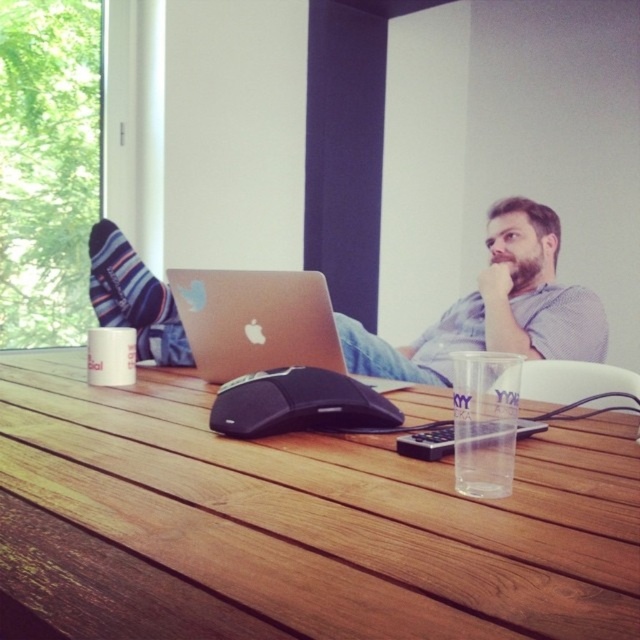
Which is behind, point (225, 381) or point (250, 412)?

The point (225, 381) is behind.

Can you confirm if silver metallic laptop at center is shorter than black matte mouse at center?

No.

What do you see at coordinates (256, 321) in the screenshot? I see `silver metallic laptop at center` at bounding box center [256, 321].

What are the coordinates of `silver metallic laptop at center` in the screenshot? It's located at (256, 321).

Does matte silver laptop at center have a smaller size compared to silver metallic laptop at center?

Incorrect, matte silver laptop at center is not smaller in size than silver metallic laptop at center.

Does matte silver laptop at center have a lesser height compared to silver metallic laptop at center?

Incorrect, matte silver laptop at center's height does not fall short of silver metallic laptop at center's.

Is point (531, 221) closer to camera compared to point (195, 342)?

No, (531, 221) is further to viewer.

The width and height of the screenshot is (640, 640). I want to click on matte silver laptop at center, so click(496, 307).

Can you confirm if wooden table at center is positioned above matte silver laptop at center?

No.

Is point (388, 561) closer to camera compared to point (156, 353)?

Yes, point (388, 561) is in front of point (156, 353).

Find the location of a particular element. wooden table at center is located at coordinates (298, 524).